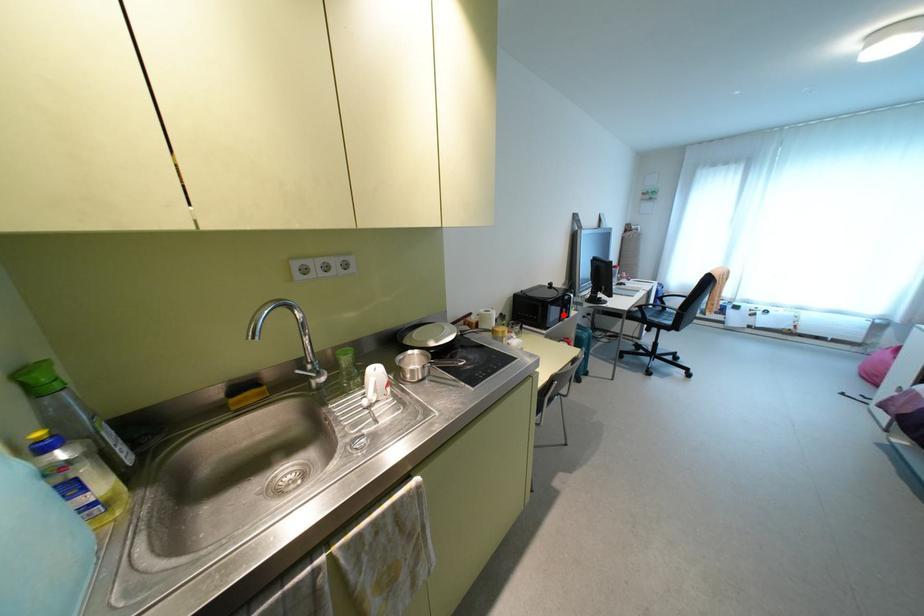
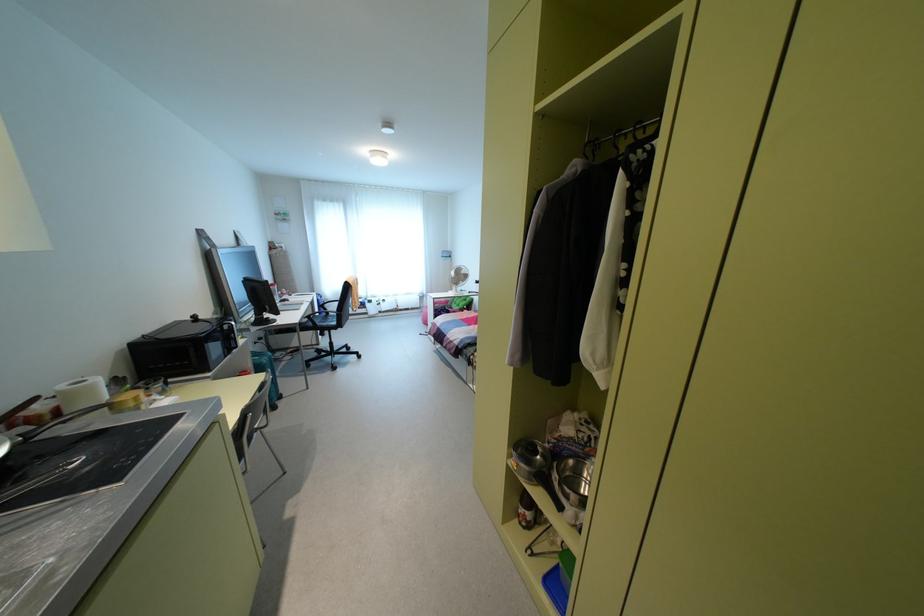
Question: A red point is marked in image1. In image2, is the corresponding 3D point closer to the camera or farther? Reply with the corresponding letter.

Choices:
 (A) The corresponding 3D point is closer.
 (B) The corresponding 3D point is farther.

Answer: (A)